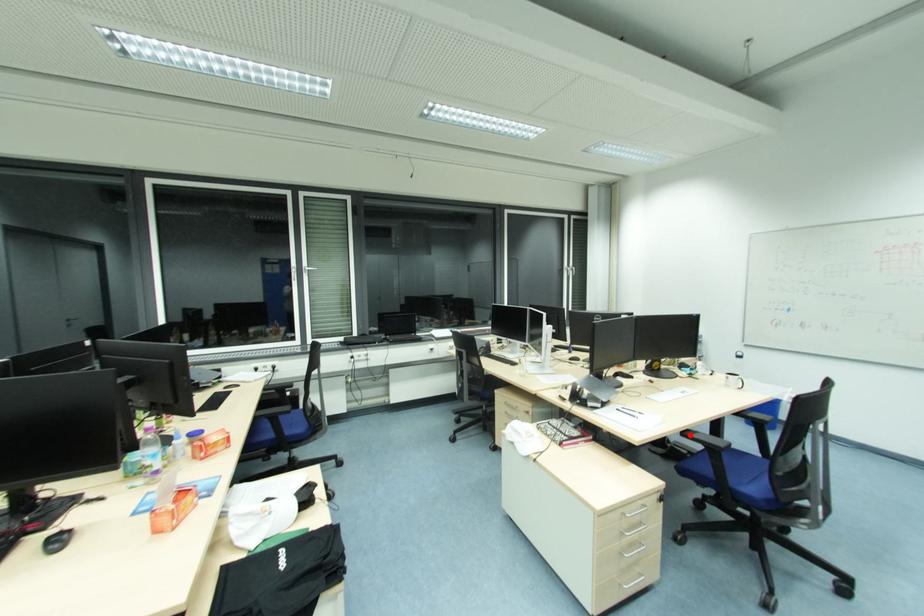
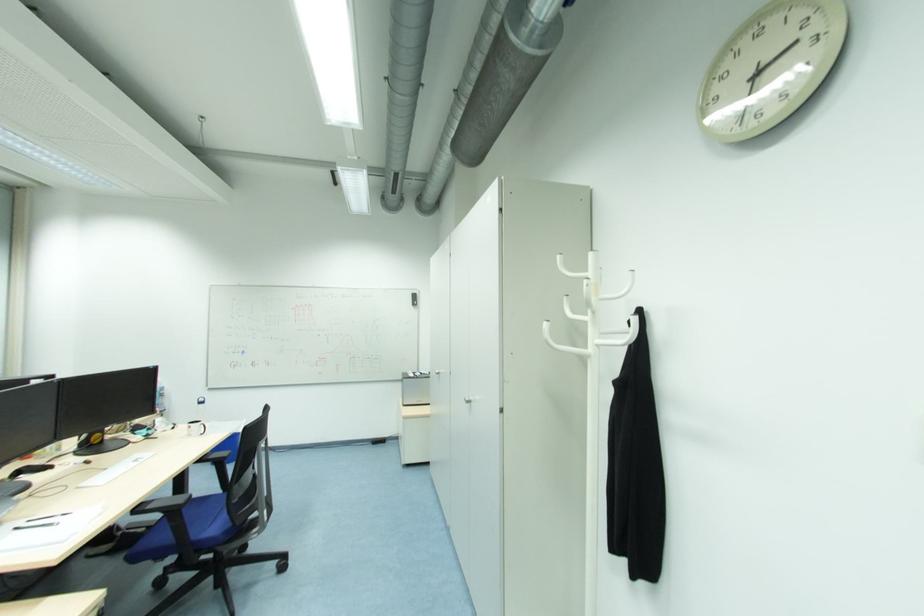
Where in the second image is the point corresponding to the highlighted location from the first image?

(142, 511)